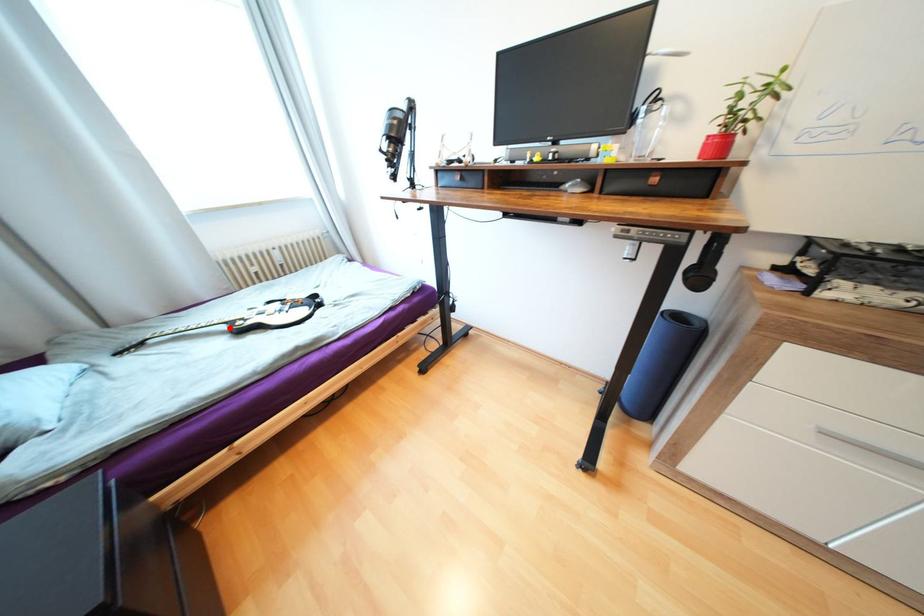
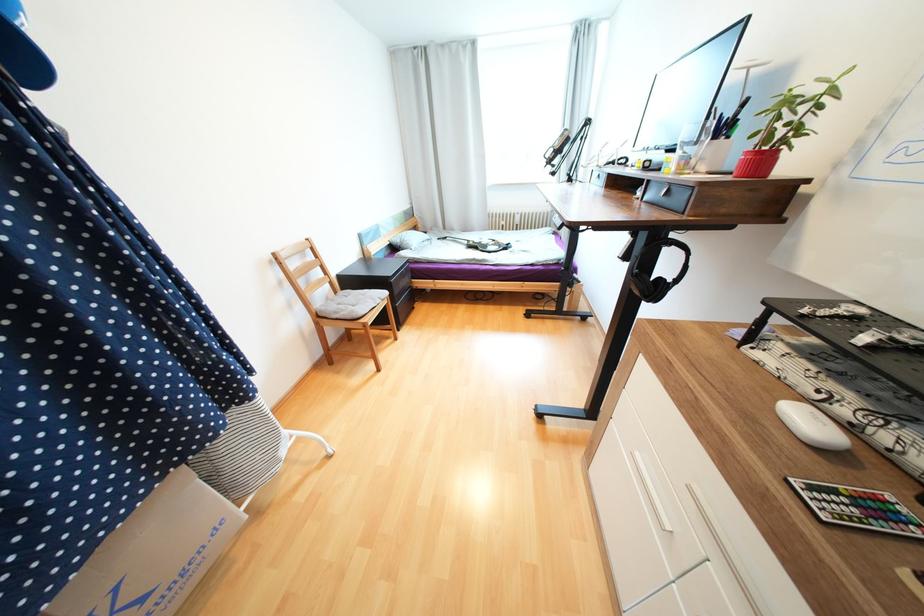
Where in the second image is the point corresponding to the highlighted location from the first image?

(471, 243)